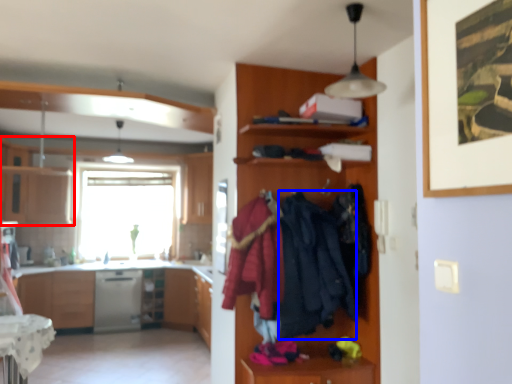
Question: Which of the following is the farthest to the observer, cabinetry (highlighted by a red box) or clothing (highlighted by a blue box)?

Choices:
 (A) cabinetry
 (B) clothing

Answer: (A)